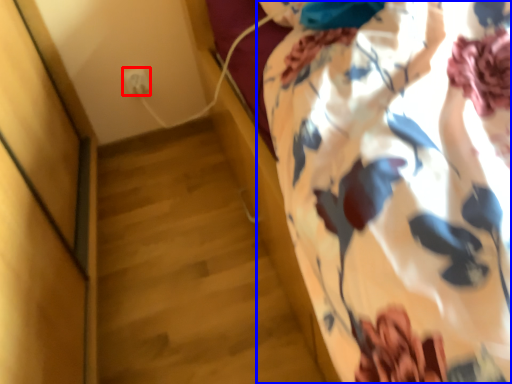
Question: Which of the following is the closest to the observer, electric outlet (highlighted by a red box) or curtain (highlighted by a blue box)?

Choices:
 (A) electric outlet
 (B) curtain

Answer: (B)